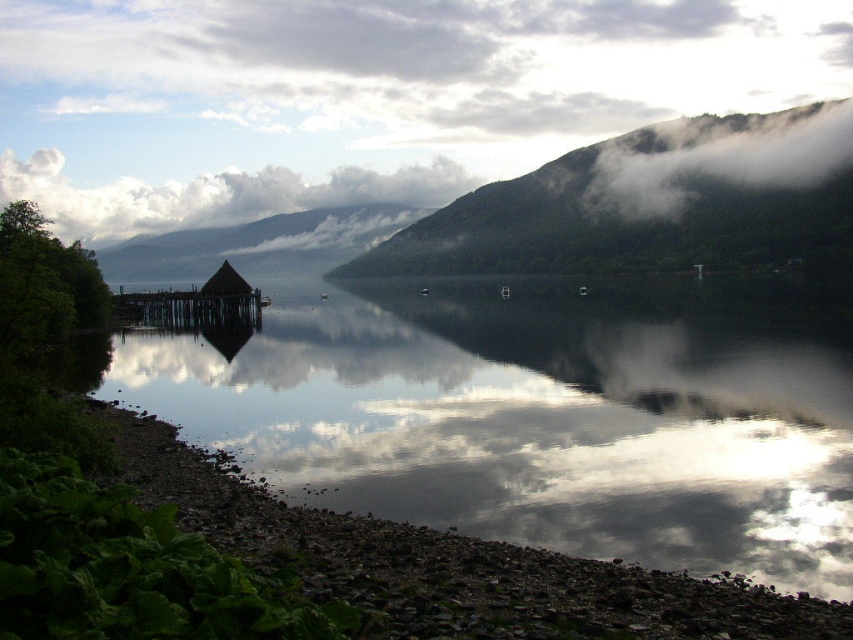
Question: Does white fluffy cloud at upper center have a greater width compared to foggy misty mountain at upper right?

Choices:
 (A) no
 (B) yes

Answer: (B)

Question: Estimate the real-world distances between objects in this image. Which object is closer to the smooth pebbles at lower left?

Choices:
 (A) foggy misty mountain at upper right
 (B) white fluffy cloud at upper center
 (C) brown wooden dock at left

Answer: (C)

Question: In this image, where is white fluffy cloud at upper center located relative to brown wooden dock at left?

Choices:
 (A) left
 (B) right

Answer: (A)

Question: Which object is closer to the camera taking this photo?

Choices:
 (A) brown wooden dock at left
 (B) green forested mountain at upper center

Answer: (A)

Question: Can you confirm if green forested mountain at upper center is bigger than brown wooden dock at left?

Choices:
 (A) yes
 (B) no

Answer: (A)

Question: Which is farther from the brown wooden dock at left?

Choices:
 (A) smooth pebbles at lower left
 (B) foggy misty mountain at upper right
 (C) white fluffy cloud at upper center

Answer: (B)